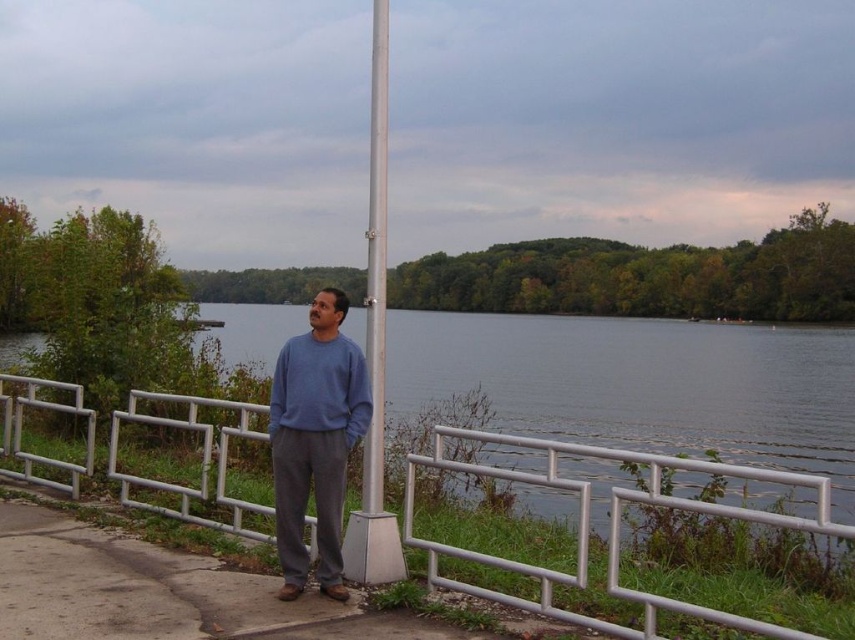
You are a visitor at the lakeside and want to take a photo of the silver metallic pole at center. Since the silver metallic fence at center is in the way, can you move around it to get a clear shot?

The silver metallic pole at center is behind the silver metallic fence at center, so you can move around the silver metallic fence at center to get a clear shot of the silver metallic pole at center.

You are standing at the center of the paved area near the railing. You want to walk towards the silver metallic fence at center. Which direction should you walk in?

The silver metallic fence at center is located at point (x=610, y=529), so you should walk towards the coordinates provided to reach it.